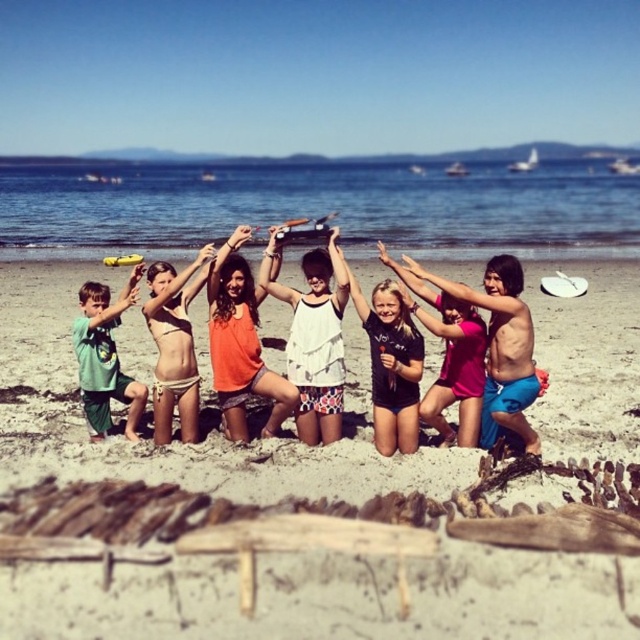
Question: Can you confirm if beige sand at center is wider than black matte swimsuit at center?

Choices:
 (A) yes
 (B) no

Answer: (A)

Question: From the image, what is the correct spatial relationship of black matte swimsuit at center in relation to white plastic frisbee at center?

Choices:
 (A) below
 (B) above

Answer: (A)

Question: Which point is closer to the camera?

Choices:
 (A) [x=173, y=321]
 (B) [x=136, y=400]
 (C) [x=244, y=298]

Answer: (A)

Question: Which point appears closest to the camera in this image?

Choices:
 (A) [x=106, y=337]
 (B) [x=305, y=324]
 (C) [x=230, y=358]

Answer: (C)

Question: Which is farther from the orange fabric top at center?

Choices:
 (A) white cotton dress at center
 (B) green cotton shirt at left
 (C) beige bikini at center

Answer: (B)

Question: Is orange fabric top at center wider than black matte swimsuit at center?

Choices:
 (A) yes
 (B) no

Answer: (A)